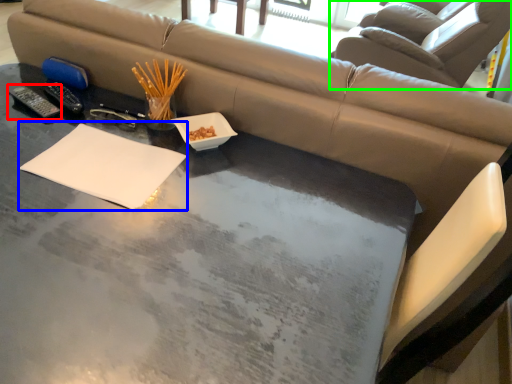
Question: Considering the real-world distances, which object is farthest from remote (highlighted by a red box)? notepad (highlighted by a blue box) or swivel chair (highlighted by a green box)?

Choices:
 (A) notepad
 (B) swivel chair

Answer: (B)